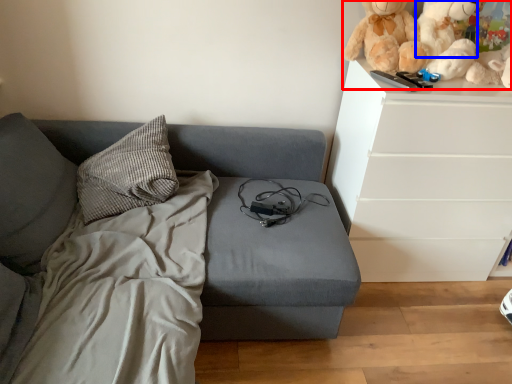
Question: Which point is further to the camera, toy (highlighted by a red box) or teddy (highlighted by a blue box)?

Choices:
 (A) toy
 (B) teddy

Answer: (B)